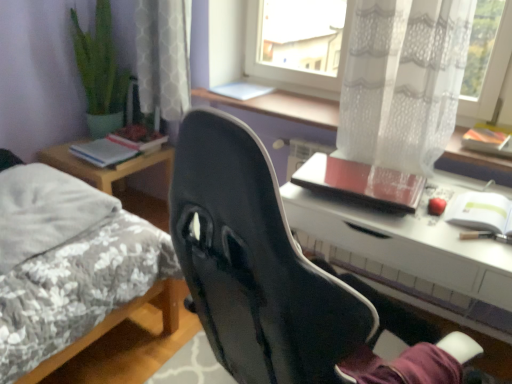
Question: Is black matte chair at center at the right side of hardcover book at left, which is counted as the first book, starting from the back?

Choices:
 (A) yes
 (B) no

Answer: (A)

Question: Is black matte chair at center thinner than hardcover book at left, which is the second book in front-to-back order?

Choices:
 (A) yes
 (B) no

Answer: (B)

Question: Is black matte chair at center further to camera compared to hardcover book at left, which is counted as the first book, starting from the back?

Choices:
 (A) yes
 (B) no

Answer: (B)

Question: Does black matte chair at center have a greater width compared to hardcover book at left, which is counted as the first book, starting from the back?

Choices:
 (A) yes
 (B) no

Answer: (A)

Question: Can you confirm if black matte chair at center is bigger than hardcover book at left, which is the second book in front-to-back order?

Choices:
 (A) yes
 (B) no

Answer: (A)

Question: Considering the positions of black matte chair at center and fluffy white pillow at left in the image, is black matte chair at center wider or thinner than fluffy white pillow at left?

Choices:
 (A) thin
 (B) wide

Answer: (B)

Question: Relative to fluffy white pillow at left, is black matte chair at center in front or behind?

Choices:
 (A) behind
 (B) front

Answer: (B)

Question: From a real-world perspective, relative to fluffy white pillow at left, is black matte chair at center vertically above or below?

Choices:
 (A) below
 (B) above

Answer: (B)

Question: Based on their positions, is black matte chair at center located to the left or right of fluffy white pillow at left?

Choices:
 (A) left
 (B) right

Answer: (B)

Question: Is point (4, 251) positioned closer to the camera than point (501, 304)?

Choices:
 (A) farther
 (B) closer

Answer: (A)

Question: From a real-world perspective, relative to white glossy desk at center, is fluffy white pillow at left vertically above or below?

Choices:
 (A) above
 (B) below

Answer: (A)

Question: Based on their sizes in the image, would you say fluffy white pillow at left is bigger or smaller than white glossy desk at center?

Choices:
 (A) small
 (B) big

Answer: (A)

Question: Visually, is fluffy white pillow at left positioned to the left or to the right of white glossy desk at center?

Choices:
 (A) right
 (B) left

Answer: (B)

Question: Considering the positions of orange matte notebook at upper right, which ranks as the 3th notebook in left-to-right order, and white paper notebook at right, which is counted as the second notebook, starting from the right, in the image, is orange matte notebook at upper right, which ranks as the 3th notebook in left-to-right order, taller or shorter than white paper notebook at right, which is counted as the second notebook, starting from the right,?

Choices:
 (A) short
 (B) tall

Answer: (B)

Question: Is orange matte notebook at upper right, which ranks as the 1th notebook in right-to-left order, to the left or to the right of white paper notebook at right, which is counted as the second notebook, starting from the right, in the image?

Choices:
 (A) right
 (B) left

Answer: (A)